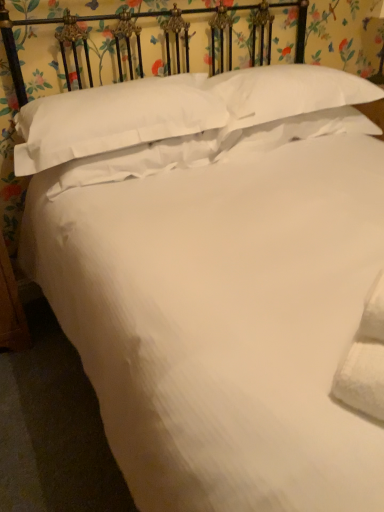
What are the coordinates of `white cotton pillow at upper center, acting as the first pillow starting from the left` in the screenshot? It's located at point(113,119).

Is white soft pillow at upper center, the 3th pillow in the left-to-right sequence, oriented away from white cotton pillow at upper center, which is counted as the 4th pillow, starting from the right?

No, white soft pillow at upper center, the 3th pillow in the left-to-right sequence, is not facing away from white cotton pillow at upper center, which is counted as the 4th pillow, starting from the right.

From a real-world perspective, who is located higher, white soft pillow at upper center, which is the second pillow in right-to-left order, or white cotton pillow at upper center, acting as the first pillow starting from the left?

white cotton pillow at upper center, acting as the first pillow starting from the left, from a real-world perspective.

Does point (235, 135) come behind point (37, 163)?

Yes, point (235, 135) is behind point (37, 163).

From a real-world perspective, is white soft pillow at center, which is the 3th pillow in right-to-left order, below white cotton pillow at upper center, acting as the first pillow starting from the left?

Indeed, from a real-world perspective, white soft pillow at center, which is the 3th pillow in right-to-left order, is positioned beneath white cotton pillow at upper center, acting as the first pillow starting from the left.

Is the surface of white soft pillow at center, which is the 3th pillow in right-to-left order, in direct contact with white cotton pillow at upper center, which is counted as the 4th pillow, starting from the right?

No, white soft pillow at center, which is the 3th pillow in right-to-left order, is not touching white cotton pillow at upper center, which is counted as the 4th pillow, starting from the right.

From the picture: Which object is further away from the camera, white soft pillow at center, which is the 3th pillow in right-to-left order, or white cotton pillow at upper center, acting as the first pillow starting from the left?

white soft pillow at center, which is the 3th pillow in right-to-left order.

Can you tell me how much white soft pillow at center, which is the 3th pillow in right-to-left order, and white cotton pillow at upper center, which is counted as the 4th pillow, starting from the right, differ in facing direction?

There is a 0.00104-degree angle between the facing directions of white soft pillow at center, which is the 3th pillow in right-to-left order, and white cotton pillow at upper center, which is counted as the 4th pillow, starting from the right.

Could you measure the distance between white soft pillow at upper center, the 3th pillow in the left-to-right sequence, and white soft pillow at upper center, positioned as the 1th pillow in right-to-left order?

10.75 centimeters.

Based on their sizes in the image, would you say white soft pillow at upper center, the 3th pillow in the left-to-right sequence, is bigger or smaller than white soft pillow at upper center, positioned as the 1th pillow in right-to-left order?

Considering their sizes, white soft pillow at upper center, the 3th pillow in the left-to-right sequence, takes up less space than white soft pillow at upper center, positioned as the 1th pillow in right-to-left order.

Is white soft pillow at upper center, the 3th pillow in the left-to-right sequence, wider than white soft pillow at upper center, the 4th pillow when ordered from left to right?

No.

From the image's perspective, count 1st pillows downward from the white soft pillow at upper center, the 4th pillow when ordered from left to right, and point to it. Please provide its 2D coordinates.

[(295, 131)]

From the image's perspective, does white cotton pillow at upper center, acting as the first pillow starting from the left, appear lower than white soft pillow at center, which ranks as the second pillow in left-to-right order?

Actually, white cotton pillow at upper center, acting as the first pillow starting from the left, appears above white soft pillow at center, which ranks as the second pillow in left-to-right order, in the image.

Where is `pillow on the left of the white soft pillow at center, which ranks as the second pillow in left-to-right order`? This screenshot has height=512, width=384. pillow on the left of the white soft pillow at center, which ranks as the second pillow in left-to-right order is located at coordinates (113, 119).

Considering the sizes of objects white cotton pillow at upper center, which is counted as the 4th pillow, starting from the right, and white soft pillow at center, which is the 3th pillow in right-to-left order, in the image provided, who is taller, white cotton pillow at upper center, which is counted as the 4th pillow, starting from the right, or white soft pillow at center, which is the 3th pillow in right-to-left order,?

white cotton pillow at upper center, which is counted as the 4th pillow, starting from the right, is taller.

Measure the distance from white soft pillow at upper center, the 3th pillow in the left-to-right sequence, to white soft pillow at center, which ranks as the second pillow in left-to-right order.

A distance of 12.66 inches exists between white soft pillow at upper center, the 3th pillow in the left-to-right sequence, and white soft pillow at center, which ranks as the second pillow in left-to-right order.

Can you confirm if white soft pillow at upper center, which is the second pillow in right-to-left order, is positioned to the right of white soft pillow at center, which ranks as the second pillow in left-to-right order?

Correct, you'll find white soft pillow at upper center, which is the second pillow in right-to-left order, to the right of white soft pillow at center, which ranks as the second pillow in left-to-right order.

Which point is more forward, (354, 115) or (94, 159)?

The point (94, 159) is in front.

You are a GUI agent. You are given a task and a screenshot of the screen. Output one action in this format:
    pyautogui.click(x=<x>, y=<y>)
    Task: Click on the pillow beneath the white soft pillow at center, which ranks as the second pillow in left-to-right order (from a real-world perspective)
    
    Given the screenshot: What is the action you would take?
    pyautogui.click(x=295, y=131)

Which object is more forward, white soft pillow at center, which is the 3th pillow in right-to-left order, or white soft pillow at upper center, the 3th pillow in the left-to-right sequence?

white soft pillow at center, which is the 3th pillow in right-to-left order, is in front.

Is white soft pillow at center, which ranks as the second pillow in left-to-right order, wider than white soft pillow at upper center, the 3th pillow in the left-to-right sequence?

No.

From their relative heights in the image, would you say white soft pillow at center, which ranks as the second pillow in left-to-right order, is taller or shorter than white soft pillow at upper center, the 3th pillow in the left-to-right sequence?

white soft pillow at center, which ranks as the second pillow in left-to-right order, is shorter than white soft pillow at upper center, the 3th pillow in the left-to-right sequence.

Where is `the 2nd pillow in front when counting from the white soft pillow at upper center, the 3th pillow in the left-to-right sequence`? This screenshot has height=512, width=384. the 2nd pillow in front when counting from the white soft pillow at upper center, the 3th pillow in the left-to-right sequence is located at coordinates (142, 160).

Can you tell me how much white cotton pillow at upper center, which is counted as the 4th pillow, starting from the right, and white soft pillow at upper center, the 3th pillow in the left-to-right sequence, differ in facing direction?

The angle between the facing direction of white cotton pillow at upper center, which is counted as the 4th pillow, starting from the right, and the facing direction of white soft pillow at upper center, the 3th pillow in the left-to-right sequence, is 0.000834 degrees.

Is white cotton pillow at upper center, which is counted as the 4th pillow, starting from the right, at the left side of white soft pillow at upper center, which is the second pillow in right-to-left order?

Yes.

Is white cotton pillow at upper center, which is counted as the 4th pillow, starting from the right, in front of white soft pillow at upper center, which is the second pillow in right-to-left order?

Yes, the depth of white cotton pillow at upper center, which is counted as the 4th pillow, starting from the right, is less than that of white soft pillow at upper center, which is the second pillow in right-to-left order.

From the image's perspective, who appears lower, white cotton pillow at upper center, acting as the first pillow starting from the left, or white soft pillow at upper center, which is the second pillow in right-to-left order?

white cotton pillow at upper center, acting as the first pillow starting from the left, appears lower in the image.

The width and height of the screenshot is (384, 512). I want to click on the 3rd pillow behind the white cotton pillow at upper center, which is counted as the 4th pillow, starting from the right, starting your count from the anchor, so click(295, 131).

In order to click on pillow in front of the white soft pillow at center, which is the 3th pillow in right-to-left order in this screenshot , I will do `click(113, 119)`.

From the image, which object appears to be farther from white soft pillow at upper center, the 4th pillow when ordered from left to right, white soft pillow at upper center, which is the second pillow in right-to-left order, or white cotton pillow at upper center, which is counted as the 4th pillow, starting from the right?

white cotton pillow at upper center, which is counted as the 4th pillow, starting from the right.

Which object lies further to the anchor point white soft pillow at upper center, positioned as the 1th pillow in right-to-left order, white cotton pillow at upper center, which is counted as the 4th pillow, starting from the right, or white soft pillow at upper center, the 3th pillow in the left-to-right sequence?

white cotton pillow at upper center, which is counted as the 4th pillow, starting from the right.

Looking at the image, which one is located further to white soft pillow at upper center, the 3th pillow in the left-to-right sequence, white soft pillow at center, which is the 3th pillow in right-to-left order, or white cotton pillow at upper center, which is counted as the 4th pillow, starting from the right?

white cotton pillow at upper center, which is counted as the 4th pillow, starting from the right, is positioned further to the anchor white soft pillow at upper center, the 3th pillow in the left-to-right sequence.

Considering their positions, is white cotton pillow at upper center, acting as the first pillow starting from the left, positioned further to white soft pillow at center, which is the 3th pillow in right-to-left order, than white soft pillow at upper center, the 3th pillow in the left-to-right sequence?

The object further to white soft pillow at center, which is the 3th pillow in right-to-left order, is white soft pillow at upper center, the 3th pillow in the left-to-right sequence.

Consider the image. Based on their spatial positions, is white soft pillow at center, which is the 3th pillow in right-to-left order, or white soft pillow at upper center, which is the second pillow in right-to-left order, closer to white soft pillow at upper center, the 4th pillow when ordered from left to right?

Based on the image, white soft pillow at upper center, which is the second pillow in right-to-left order, appears to be nearer to white soft pillow at upper center, the 4th pillow when ordered from left to right.

From the image, which object appears to be farther from white soft pillow at center, which ranks as the second pillow in left-to-right order, white soft pillow at upper center, the 4th pillow when ordered from left to right, or white cotton pillow at upper center, which is counted as the 4th pillow, starting from the right?

The object further to white soft pillow at center, which ranks as the second pillow in left-to-right order, is white soft pillow at upper center, the 4th pillow when ordered from left to right.

Looking at the image, which one is located further to white soft pillow at upper center, which is the second pillow in right-to-left order, white soft pillow at upper center, positioned as the 1th pillow in right-to-left order, or white soft pillow at center, which ranks as the second pillow in left-to-right order?

The object further to white soft pillow at upper center, which is the second pillow in right-to-left order, is white soft pillow at center, which ranks as the second pillow in left-to-right order.

Looking at the image, which one is located closer to white soft pillow at upper center, the 3th pillow in the left-to-right sequence, white soft pillow at center, which is the 3th pillow in right-to-left order, or white soft pillow at upper center, positioned as the 1th pillow in right-to-left order?

white soft pillow at upper center, positioned as the 1th pillow in right-to-left order, is closer to white soft pillow at upper center, the 3th pillow in the left-to-right sequence.

In order to click on pillow situated between white soft pillow at center, which ranks as the second pillow in left-to-right order, and white soft pillow at upper center, positioned as the 1th pillow in right-to-left order, from left to right in this screenshot , I will do `click(295, 131)`.

This screenshot has height=512, width=384. What are the coordinates of `pillow between white cotton pillow at upper center, acting as the first pillow starting from the left, and white soft pillow at upper center, which is the second pillow in right-to-left order, from left to right` in the screenshot? It's located at (142, 160).